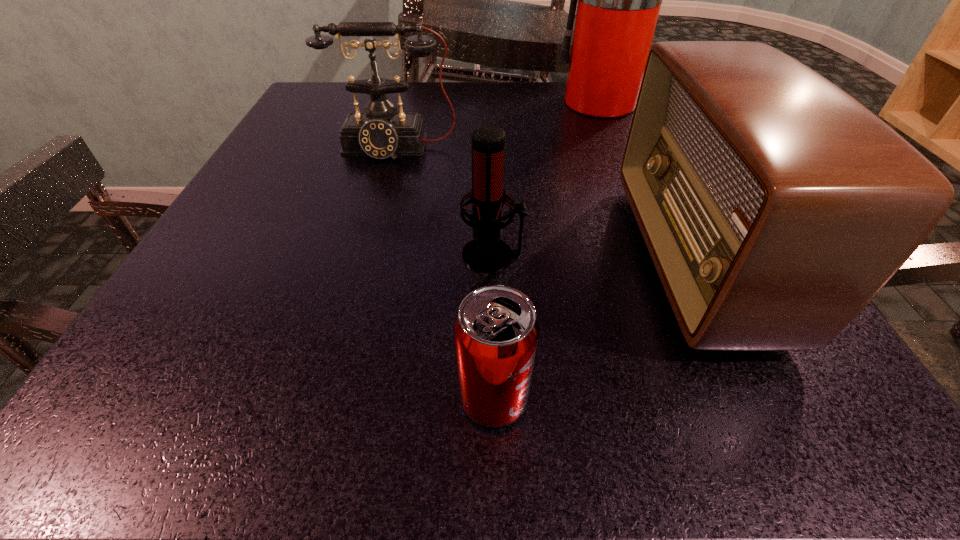
I want to click on vacant space that's between the microphone and the fire extinguisher, so click(x=547, y=179).

Locate an element on the screen. The image size is (960, 540). empty space between the radio receiver and the leftmost object is located at coordinates (542, 203).

The height and width of the screenshot is (540, 960). In order to click on unoccupied area between the microphone and the tallest object in this screenshot , I will do `click(547, 179)`.

Identify the location of free space between the soda can and the fire extinguisher. (547, 251).

Locate which object is the closest to the farthest object. Please provide its 2D coordinates. Your answer should be formatted as a tuple, i.e. [(x, y)], where the tuple contains the x and y coordinates of a point satisfying the conditions above.

[(380, 132)]

Find the location of a particular element. object that is the closest to the radio receiver is located at coordinates (486, 252).

Locate an element on the screen. The width and height of the screenshot is (960, 540). free location that satisfies the following two spatial constraints: 1. at the nozzle of the fire extinguisher; 2. on the dial of the leftmost object is located at coordinates (622, 148).

Identify the location of vacant space that satisfies the following two spatial constraints: 1. on the dial of the microphone; 2. on the left side of the second farthest object. Image resolution: width=960 pixels, height=540 pixels. (364, 255).

The height and width of the screenshot is (540, 960). Find the location of `free space that satisfies the following two spatial constraints: 1. on the dial of the telephone; 2. on the right side of the soda can`. free space that satisfies the following two spatial constraints: 1. on the dial of the telephone; 2. on the right side of the soda can is located at coordinates (324, 399).

What are the coordinates of `free space that satisfies the following two spatial constraints: 1. on the dial of the telephone; 2. on the right side of the second shortest object` in the screenshot? It's located at (364, 255).